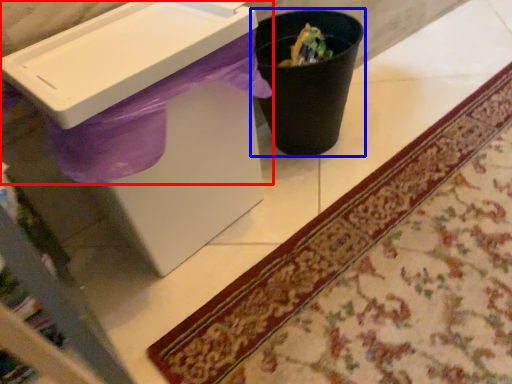
Question: Which point is further to the camera, sink (highlighted by a red box) or waste container (highlighted by a blue box)?

Choices:
 (A) sink
 (B) waste container

Answer: (B)